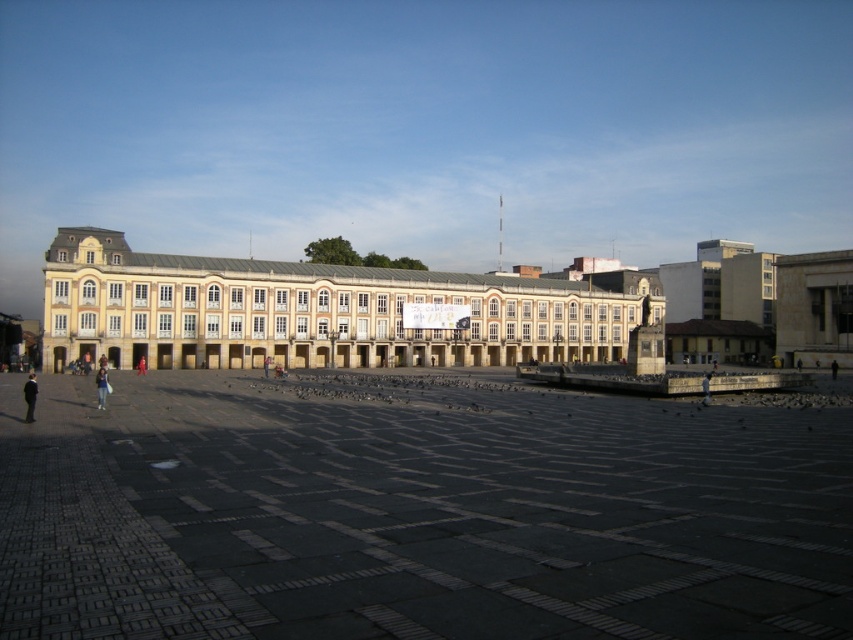
Is point (99, 396) farther from viewer compared to point (143, 369)?

No, (99, 396) is closer to viewer.

Does dark blue jeans at center have a lesser height compared to red fabric person at center?

In fact, dark blue jeans at center may be taller than red fabric person at center.

Locate an element on the screen. Image resolution: width=853 pixels, height=640 pixels. dark blue jeans at center is located at coordinates (102, 385).

Between dark gray stone pavement at center and red fabric person at center, which one has less height?

Standing shorter between the two is red fabric person at center.

Between dark gray stone pavement at center and red fabric person at center, which one appears on the left side from the viewer's perspective?

red fabric person at center

Find the location of a particular element. dark gray stone pavement at center is located at coordinates (416, 516).

What do you see at coordinates (30, 396) in the screenshot?
I see `dark gray suit at lower left` at bounding box center [30, 396].

Does point (33, 378) lie behind point (102, 401)?

Yes, point (33, 378) is behind point (102, 401).

This screenshot has width=853, height=640. I want to click on dark gray suit at lower left, so click(30, 396).